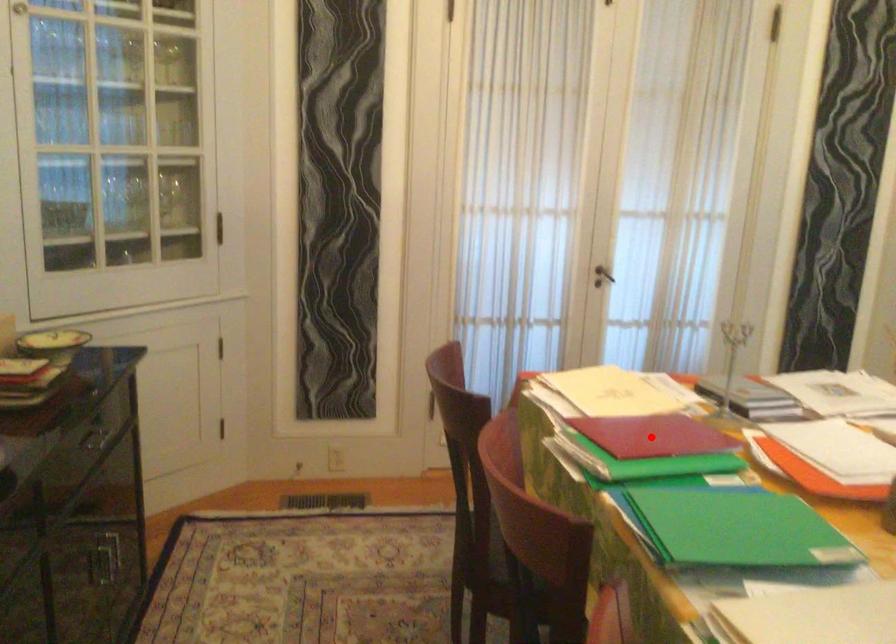
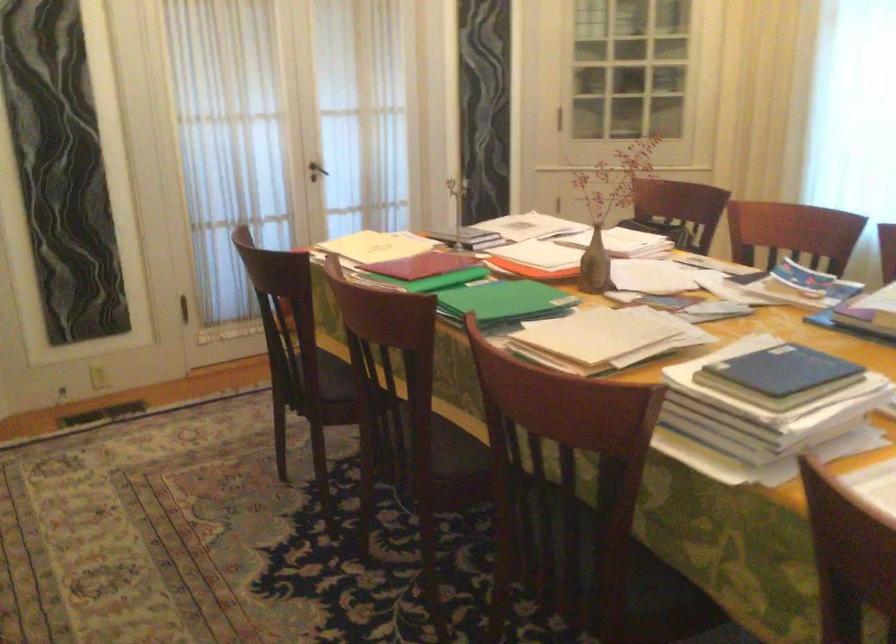
Question: I am providing you with two images of the same scene from different viewpoints. A red point is shown in image1. For the corresponding object point in image2, is it positioned nearer or farther from the camera?

Choices:
 (A) Nearer
 (B) Farther

Answer: (B)